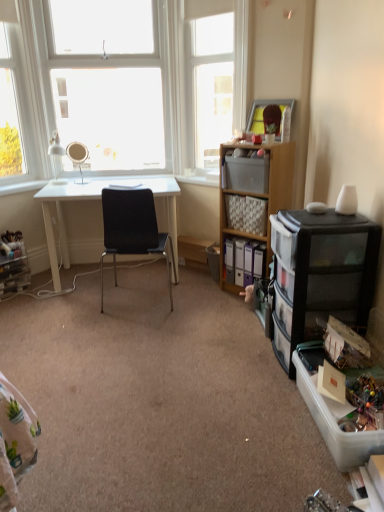
Locate an element on the screen. vacant space underneath black mesh chair at center (from a real-world perspective) is located at coordinates (x=132, y=303).